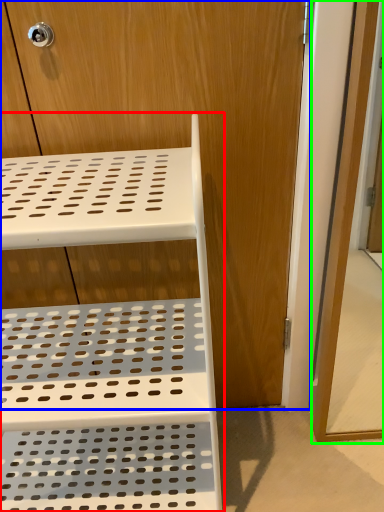
Question: Which is farther away from furniture (highlighted by a red box)? dresser (highlighted by a blue box) or screen door (highlighted by a green box)?

Choices:
 (A) dresser
 (B) screen door

Answer: (B)